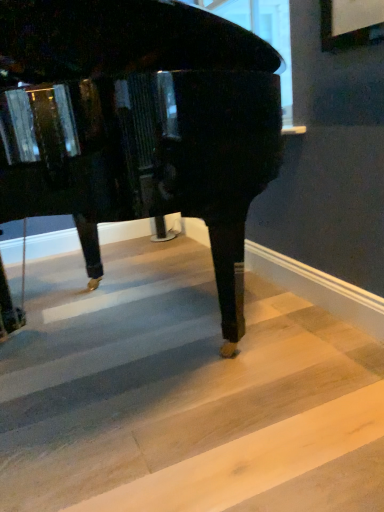
Question: From a real-world perspective, relative to light wood stair at lower right, is glossy black piano at center vertically above or below?

Choices:
 (A) above
 (B) below

Answer: (A)

Question: Is glossy black piano at center inside the boundaries of light wood stair at lower right, or outside?

Choices:
 (A) inside
 (B) outside

Answer: (B)

Question: Is point (241, 245) closer or farther from the camera than point (137, 374)?

Choices:
 (A) closer
 (B) farther

Answer: (B)

Question: From a real-world perspective, is light wood stair at lower right physically located above or below glossy black piano at center?

Choices:
 (A) above
 (B) below

Answer: (B)

Question: Considering the positions of light wood stair at lower right and glossy black piano at center in the image, is light wood stair at lower right bigger or smaller than glossy black piano at center?

Choices:
 (A) big
 (B) small

Answer: (B)

Question: Considering the positions of point (173, 354) and point (6, 53), is point (173, 354) closer or farther from the camera than point (6, 53)?

Choices:
 (A) farther
 (B) closer

Answer: (B)

Question: Considering the positions of light wood stair at lower right and glossy black piano at center in the image, is light wood stair at lower right wider or thinner than glossy black piano at center?

Choices:
 (A) thin
 (B) wide

Answer: (B)